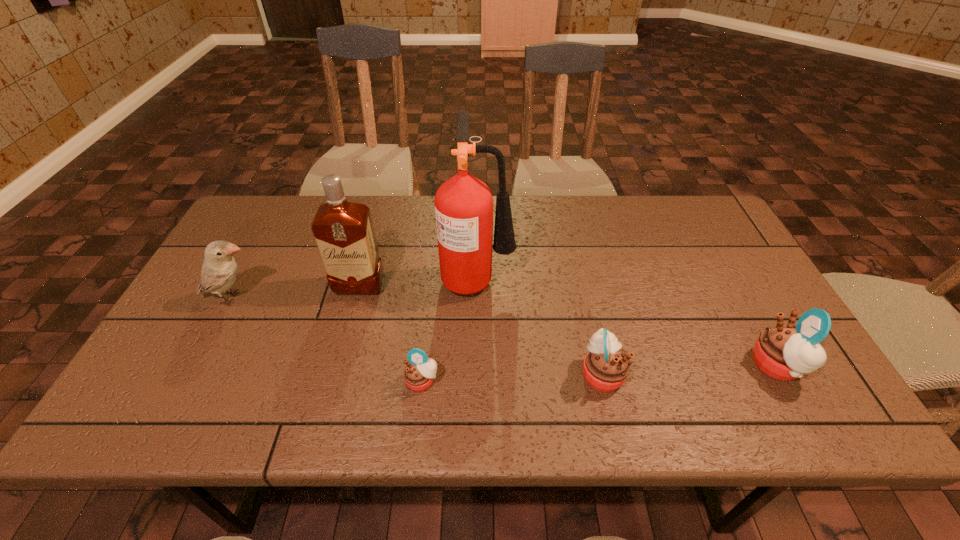
You are a GUI agent. You are given a task and a screenshot of the screen. Output one action in this format:
    pyautogui.click(x=<x>, y=<y>)
    Task: Click on the blank space located 0.300m on the front-facing side of the rightmost muffin
    Image resolution: width=960 pixels, height=540 pixels.
    Given the screenshot: What is the action you would take?
    pyautogui.click(x=621, y=366)

Identify the location of vacant space located 0.340m on the front-facing side of the rightmost muffin. Image resolution: width=960 pixels, height=540 pixels. (604, 366).

This screenshot has height=540, width=960. Find the location of `free space located on the front-facing side of the rightmost muffin`. free space located on the front-facing side of the rightmost muffin is located at coordinates (612, 366).

Locate an element on the screen. free spot located 0.200m on the front label of the liquor is located at coordinates (339, 362).

Identify the location of vacant space situated at the nozzle of the fire extinguisher. (586, 276).

At what (x,y) coordinates should I click in order to perform the action: click on free region located at the face of the leftmost object. Please return your answer as a coordinate pair (x, y). Looking at the image, I should click on (374, 298).

Identify the location of object located in the left edge section of the desktop. (219, 270).

Where is `object at the right edge`? The height and width of the screenshot is (540, 960). object at the right edge is located at coordinates (785, 352).

The width and height of the screenshot is (960, 540). I want to click on object that is at the near right corner, so click(x=785, y=352).

In the image, there is a desktop. At what (x,y) coordinates should I click in order to perform the action: click on vacant space at the far edge. Please return your answer as a coordinate pair (x, y). Image resolution: width=960 pixels, height=540 pixels. Looking at the image, I should click on (611, 218).